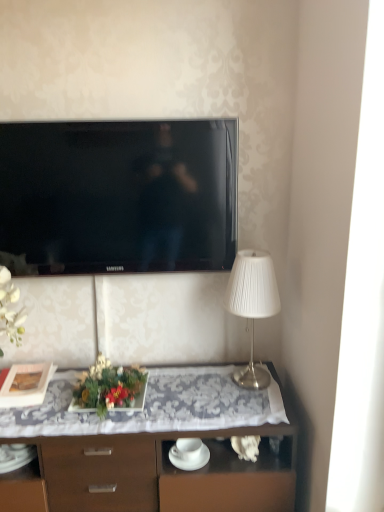
Question: Is green leafy plant at center in front of or behind matte black picture frame at left in the image?

Choices:
 (A) behind
 (B) front

Answer: (B)

Question: Based on their sizes in the image, would you say green leafy plant at center is bigger or smaller than matte black picture frame at left?

Choices:
 (A) big
 (B) small

Answer: (A)

Question: Estimate the real-world distances between objects in this image. Which object is farther from the matte black picture frame at left?

Choices:
 (A) white pleated fabric lampshade at right
 (B) black glossy tv at upper center
 (C) wooden desk at center
 (D) green leafy plant at center

Answer: (A)

Question: Considering the real-world distances, which object is closest to the matte black picture frame at left?

Choices:
 (A) wooden desk at center
 (B) white pleated fabric lampshade at right
 (C) green leafy plant at center
 (D) black glossy tv at upper center

Answer: (C)